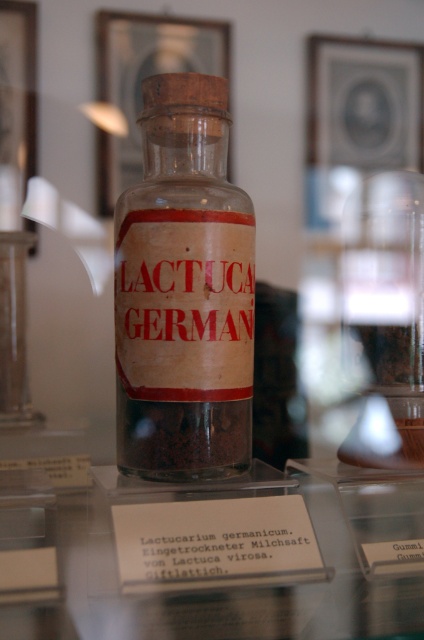
Is transparent glass jar at center behind white paper label at center?

Yes.

Who is positioned more to the right, transparent glass jar at center or white paper label at center?

transparent glass jar at center is more to the right.

Who is more forward, (x=421, y=230) or (x=256, y=547)?

Point (x=256, y=547)

I want to click on transparent glass jar at center, so (x=387, y=316).

Between transparent glass table at center and transparent glass bottle at center, which one has more height?

With more height is transparent glass bottle at center.

Between transparent glass table at center and transparent glass bottle at center, which one appears on the right side from the viewer's perspective?

From the viewer's perspective, transparent glass table at center appears more on the right side.

Describe the element at coordinates (204, 557) in the screenshot. I see `transparent glass table at center` at that location.

Locate an element on the screen. The width and height of the screenshot is (424, 640). transparent glass table at center is located at coordinates (204, 557).

You are a GUI agent. You are given a task and a screenshot of the screen. Output one action in this format:
    pyautogui.click(x=<x>, y=<y>)
    Task: Click on the transparent glass table at center
    The image size is (424, 640).
    Given the screenshot: What is the action you would take?
    pyautogui.click(x=204, y=557)